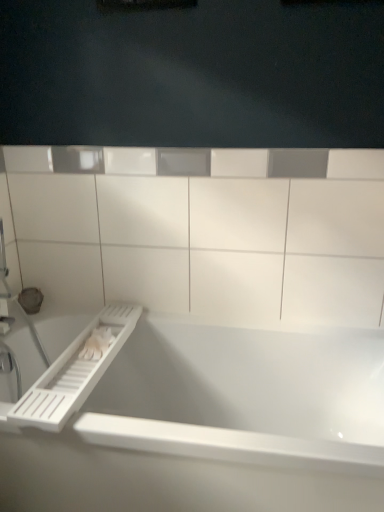
Locate an element on the screen. The image size is (384, 512). free space above white plastic ledge at upper center (from a real-world perspective) is located at coordinates (200, 148).